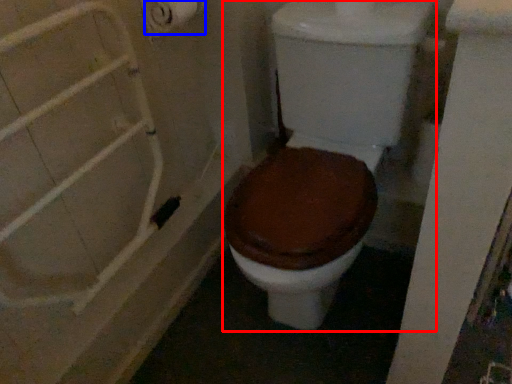
Question: Which point is further to the camera, toilet (highlighted by a red box) or toilet paper (highlighted by a blue box)?

Choices:
 (A) toilet
 (B) toilet paper

Answer: (B)